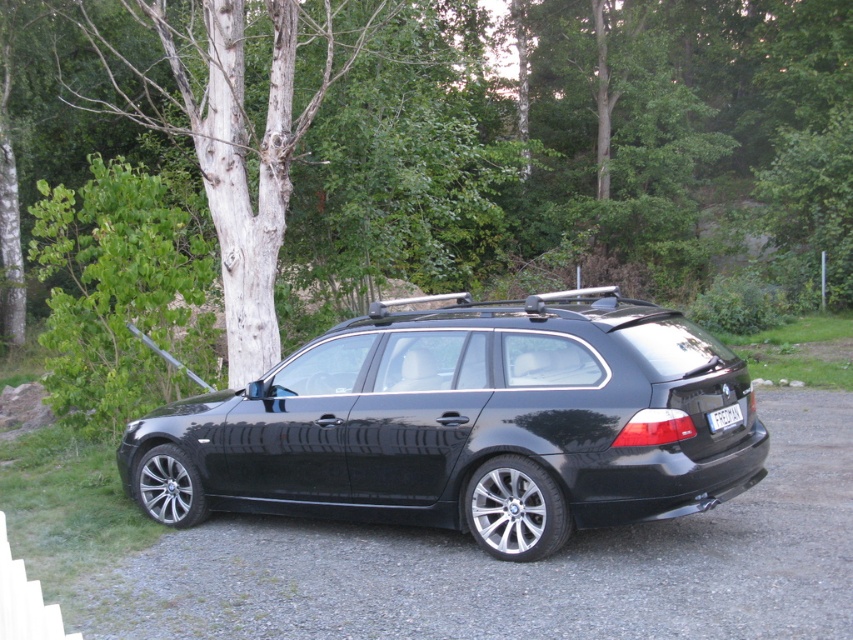
Question: Estimate the real-world distances between objects in this image. Which object is farther from the glossy black car at center?

Choices:
 (A) white plastic license plate at rear
 (B) smooth bark tree at left

Answer: (B)

Question: Can you confirm if glossy black car at center is positioned above smooth bark tree at left?

Choices:
 (A) yes
 (B) no

Answer: (B)

Question: Does glossy black car at center have a lesser width compared to white plastic license plate at rear?

Choices:
 (A) no
 (B) yes

Answer: (A)

Question: Among these points, which one is farthest from the camera?

Choices:
 (A) (798, 536)
 (B) (277, 202)
 (C) (173, 499)

Answer: (B)

Question: Can you confirm if glossy black car at center is positioned to the left of smooth bark tree at left?

Choices:
 (A) yes
 (B) no

Answer: (B)

Question: Estimate the real-world distances between objects in this image. Which object is closer to the smooth bark tree at left?

Choices:
 (A) black asphalt at center
 (B) white plastic license plate at rear

Answer: (B)